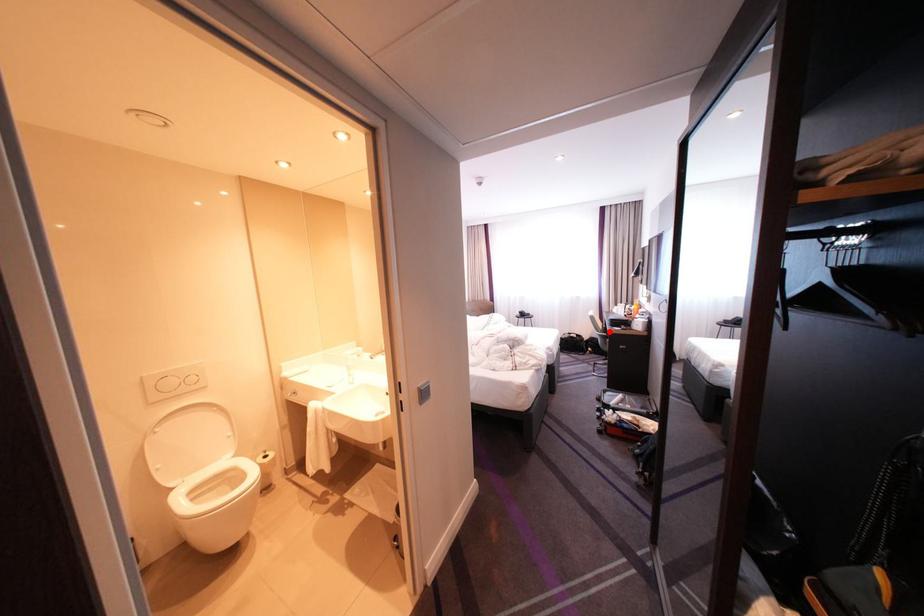
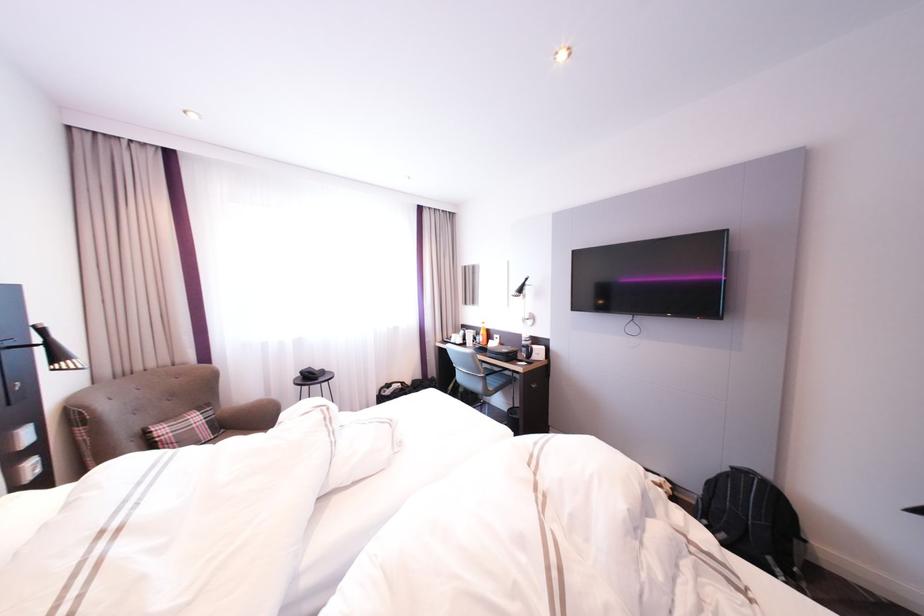
Question: I am providing you with two images of the same scene from different viewpoints. Given a red point in image1, look at the same physical point in image2. Is it:

Choices:
 (A) Closer to the viewpoint
 (B) Farther from the viewpoint

Answer: (B)